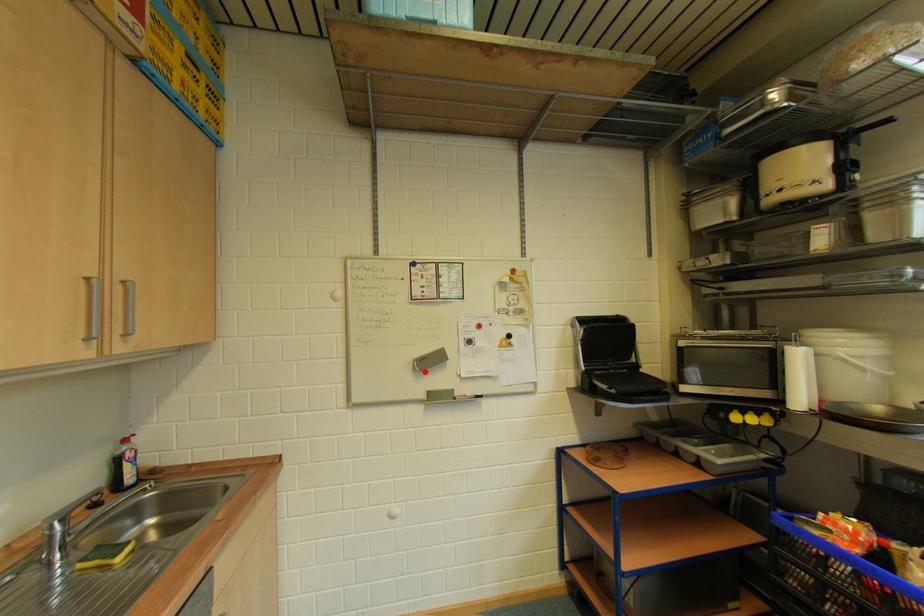
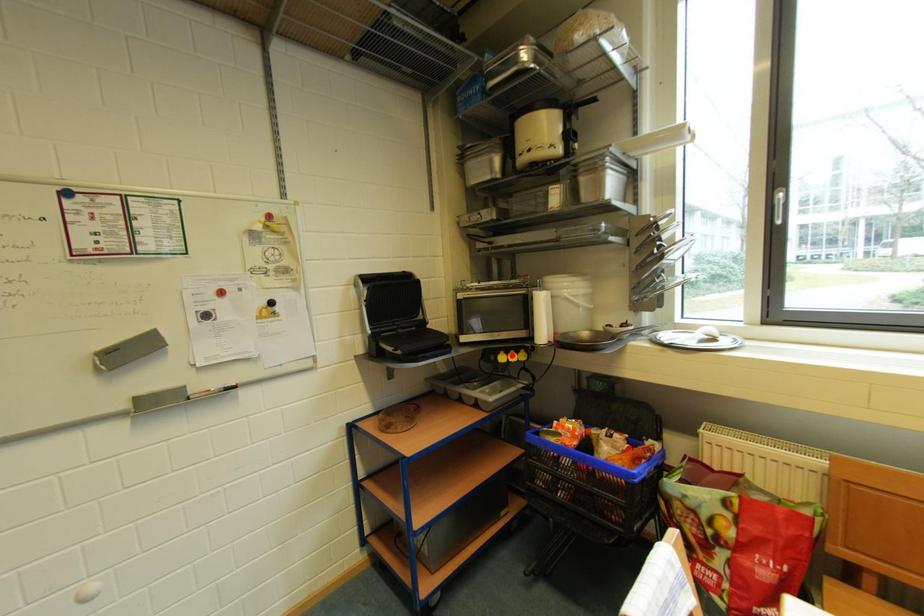
I am providing you with two images of the same scene from different viewpoints. A red point is marked on the first image and another point is marked on the second image. Is the marked point in image1 the same physical position as the marked point in image2?

No